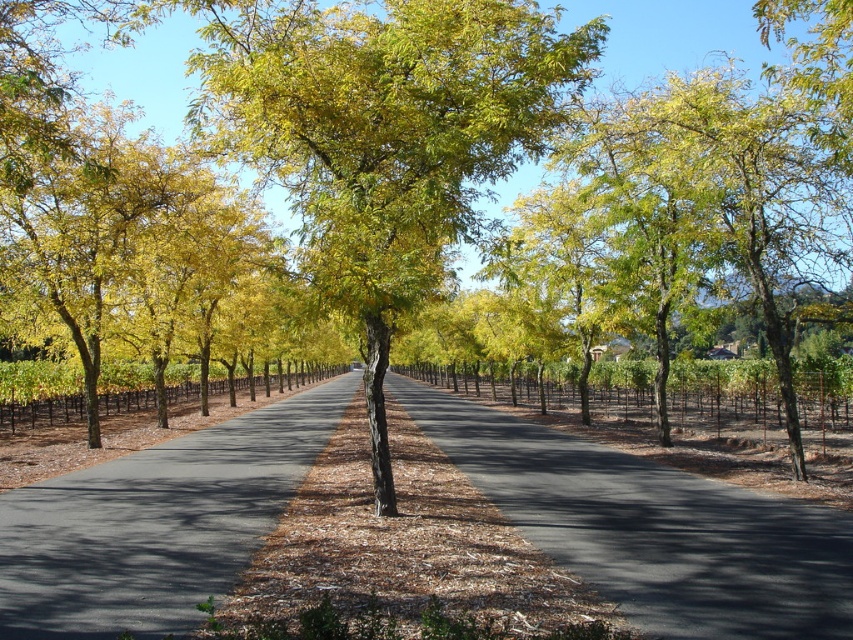
Which of these two, brown dirt road at center or brown asphalt road at center, stands taller?

brown asphalt road at center

Which is behind, point (701, 612) or point (97, 600)?

The point (97, 600) is behind.

Where is `brown dirt road at center`? This screenshot has height=640, width=853. brown dirt road at center is located at coordinates (651, 528).

Does green leafy tree at center have a lesser height compared to brown asphalt road at center?

No, green leafy tree at center is not shorter than brown asphalt road at center.

Who is shorter, green leafy tree at center or brown asphalt road at center?

brown asphalt road at center is shorter.

Does point (244, 125) come in front of point (167, 532)?

No, (244, 125) is behind (167, 532).

Identify the location of green leafy tree at center. (384, 136).

Is green leafy tree at center to the right of brown dirt road at center from the viewer's perspective?

In fact, green leafy tree at center is to the left of brown dirt road at center.

Between green leafy tree at center and brown dirt road at center, which one has less height?

brown dirt road at center

Describe the element at coordinates (384, 136) in the screenshot. I see `green leafy tree at center` at that location.

Identify the location of green leafy tree at center. The width and height of the screenshot is (853, 640). (384, 136).